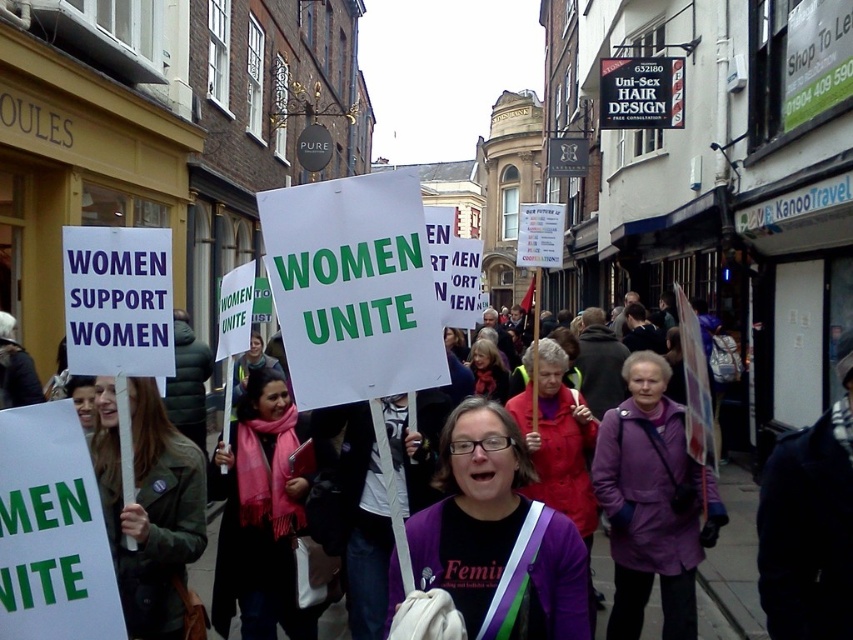
Question: Among these points, which one is farthest from the camera?

Choices:
 (A) (148, 422)
 (B) (688, 586)
 (C) (309, 620)

Answer: (B)

Question: Does purple fabric at center appear under purple fabric coat at center?

Choices:
 (A) yes
 (B) no

Answer: (B)

Question: Which object is farther from the camera taking this photo?

Choices:
 (A) matte red coat at center
 (B) purple fabric at center
 (C) pink scarf at center

Answer: (C)

Question: Where is green matte jacket at left located in relation to matte red coat at center in the image?

Choices:
 (A) below
 (B) above

Answer: (B)

Question: Which object is closer to the camera taking this photo?

Choices:
 (A) matte red coat at center
 (B) purple fabric at center
 (C) matte pink scarf at center
 (D) green matte jacket at left

Answer: (B)

Question: Does purple fabric coat at center have a greater width compared to matte pink scarf at center?

Choices:
 (A) no
 (B) yes

Answer: (B)